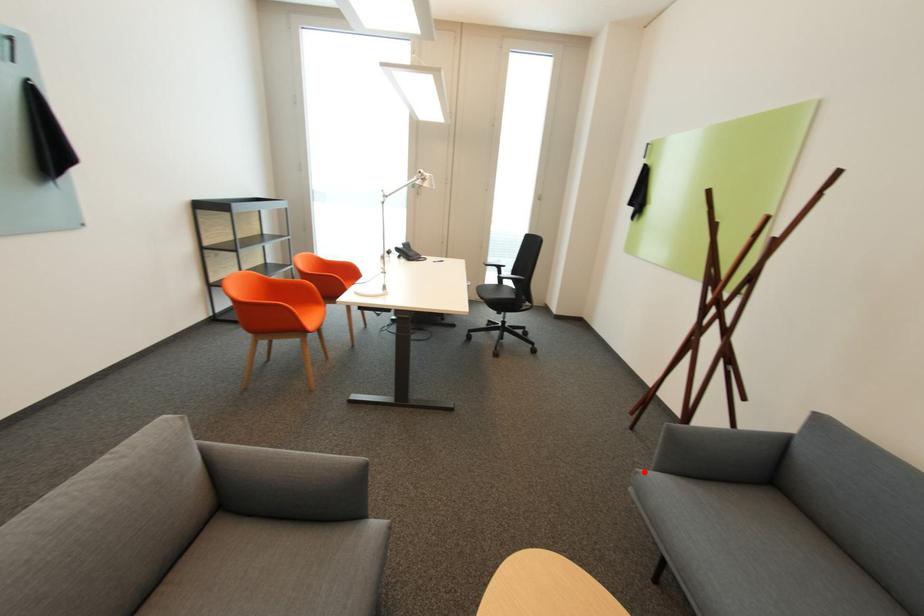
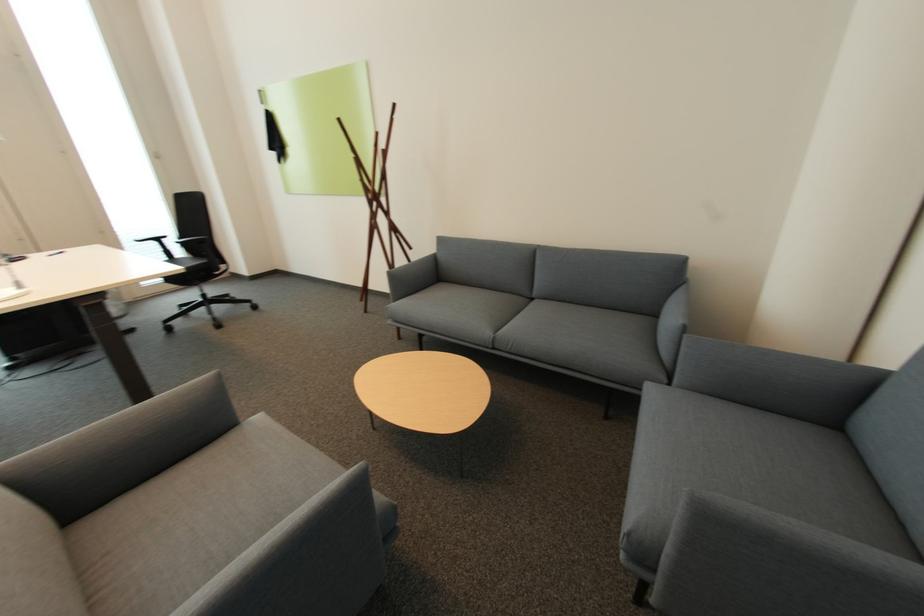
The point at the highlighted location is marked in the first image. Where is the corresponding point in the second image?

(394, 308)